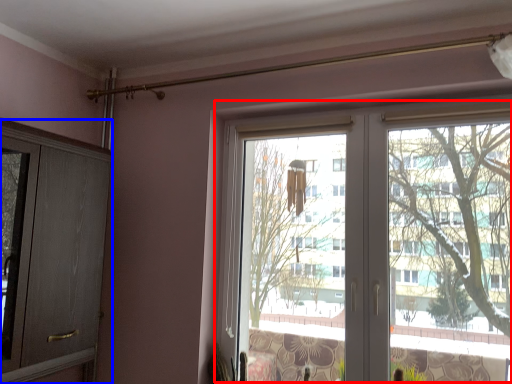
Question: Among these objects, which one is farthest to the camera, bay window (highlighted by a red box) or screen door (highlighted by a blue box)?

Choices:
 (A) bay window
 (B) screen door

Answer: (A)